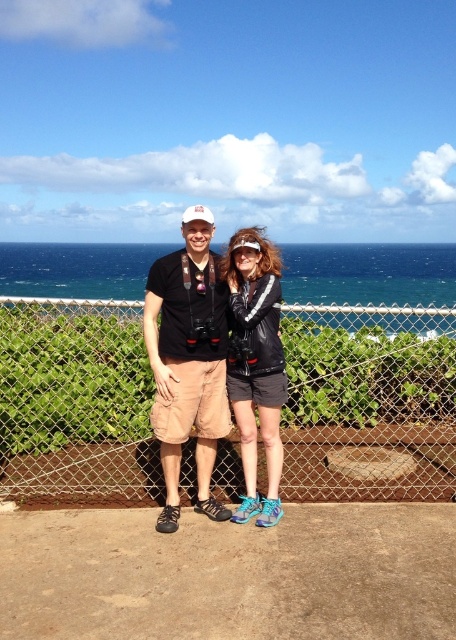
Does metal mesh fence at center have a greater height compared to black matte shorts at center?

No, metal mesh fence at center is not taller than black matte shorts at center.

Does point (53, 387) lie in front of point (171, 408)?

No.

Is point (134, 317) farther from viewer compared to point (171, 472)?

Yes.

This screenshot has height=640, width=456. Identify the location of metal mesh fence at center. (368, 403).

Consider the image. Is black matte shorts at center bigger than matte black jacket at center?

Yes, black matte shorts at center is bigger than matte black jacket at center.

Is black matte shorts at center above matte black jacket at center?

Correct, black matte shorts at center is located above matte black jacket at center.

Between point (195, 291) and point (269, 416), which one is positioned behind?

Point (195, 291)

The width and height of the screenshot is (456, 640). I want to click on black matte shorts at center, so click(x=187, y=360).

Does metal mesh fence at center have a greater width compared to matte black jacket at center?

In fact, metal mesh fence at center might be narrower than matte black jacket at center.

Does metal mesh fence at center lie in front of matte black jacket at center?

No, metal mesh fence at center is further to the viewer.

The width and height of the screenshot is (456, 640). Identify the location of metal mesh fence at center. (368, 403).